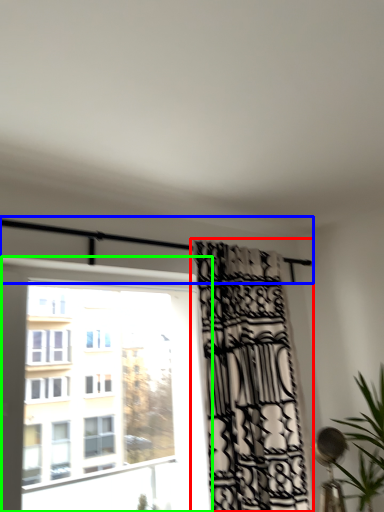
Question: Which object is positioned farthest from curtain (highlighted by a red box)? Select from balcony (highlighted by a blue box) and window (highlighted by a green box).

Choices:
 (A) balcony
 (B) window

Answer: (B)